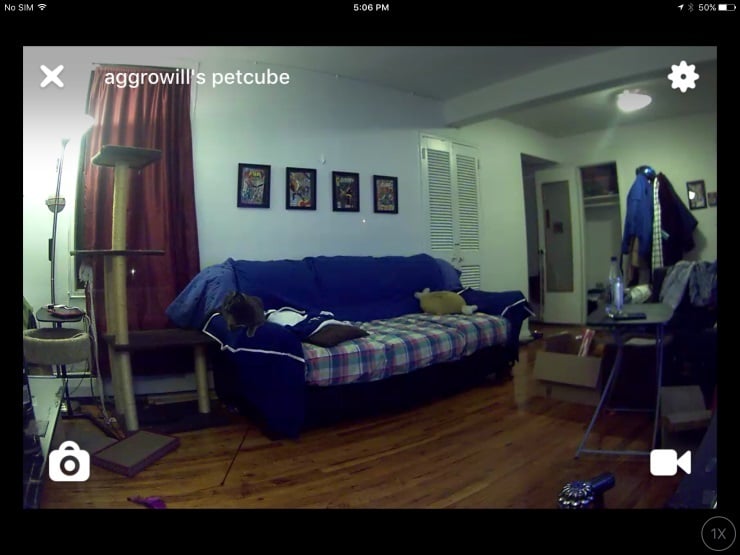
The width and height of the screenshot is (740, 555). In order to click on cat tower in this screenshot , I will do `click(132, 162)`, `click(130, 400)`, `click(143, 458)`.